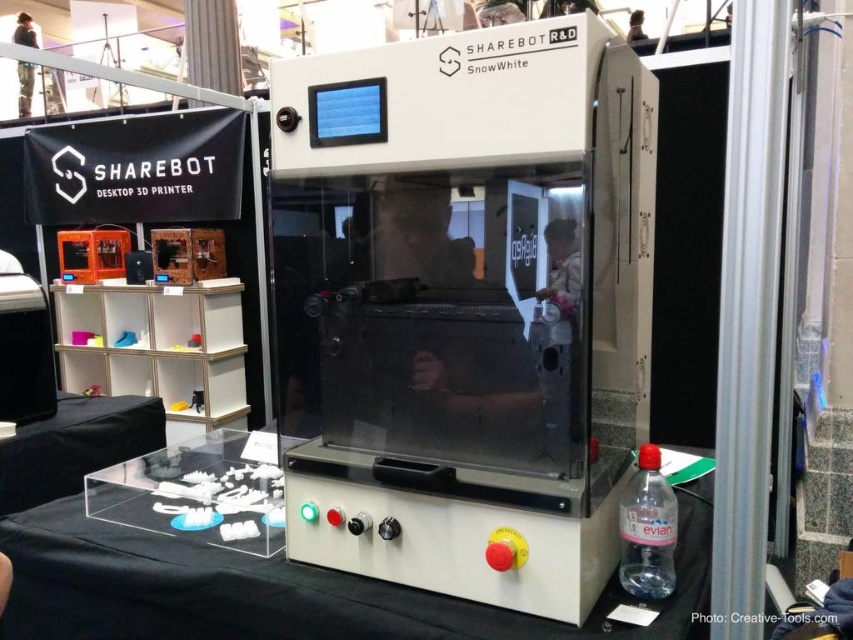
You are at a trade show and want to take a closer look at the white plastic 3d printer at center. Since you are standing in front of the white plastic table at center, can you easily walk around it to reach the printer?

The white plastic 3d printer at center is closer to the viewer than the white plastic table at center, so you can easily walk around the white plastic table at center to reach the printer since it is behind the table.

In the scene shown: You are at a trade show and looking at the Sharebot SnowWhite desktop 3D printer. There are two points marked on the printer. The first point is at coordinate (302, 522) and the second is at (274, 561). Which of these points is closer to you?

Point (302, 522) is closer to the viewer than point (274, 561).